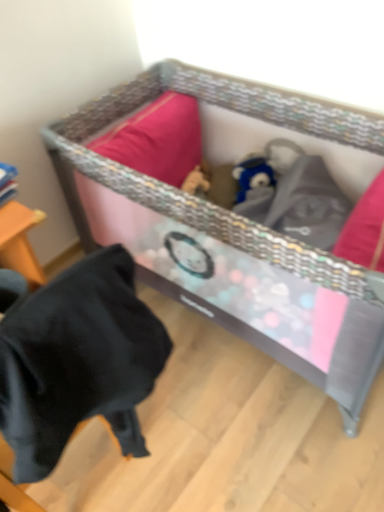
Question: Is black fabric at lower left in front of or behind textured woven crib at center in the image?

Choices:
 (A) behind
 (B) front

Answer: (B)

Question: Is black fabric at lower left spatially inside textured woven crib at center, or outside of it?

Choices:
 (A) inside
 (B) outside

Answer: (B)

Question: Is point (16, 477) positioned closer to the camera than point (92, 132)?

Choices:
 (A) closer
 (B) farther

Answer: (A)

Question: Which is correct: textured woven crib at center is inside black fabric at lower left, or outside of it?

Choices:
 (A) outside
 (B) inside

Answer: (A)

Question: Considering their positions, is textured woven crib at center located in front of or behind black fabric at lower left?

Choices:
 (A) front
 (B) behind

Answer: (B)

Question: From the image's perspective, is textured woven crib at center located above or below black fabric at lower left?

Choices:
 (A) above
 (B) below

Answer: (A)

Question: From a real-world perspective, is textured woven crib at center above or below black fabric at lower left?

Choices:
 (A) above
 (B) below

Answer: (B)